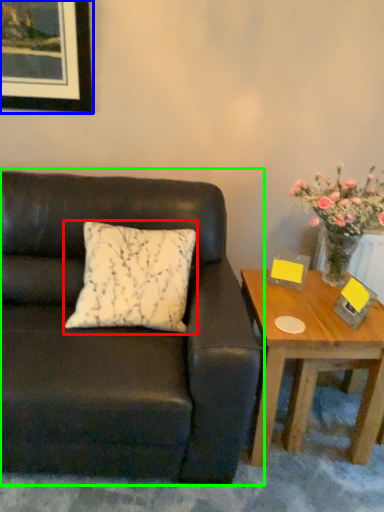
Question: Based on their relative distances, which object is farther from pillow (highlighted by a red box)? Choose from picture frame (highlighted by a blue box) and studio couch (highlighted by a green box).

Choices:
 (A) picture frame
 (B) studio couch

Answer: (A)